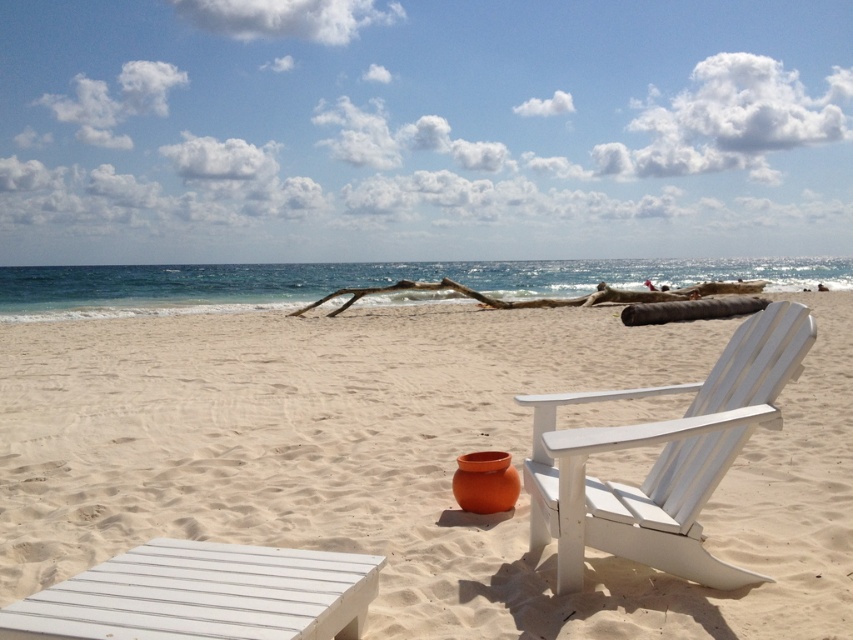
You are standing on the beach and want to place a 2.5 meter long surfboard between you and the white wood beach chair at center right. Is there enough space to place the surfboard without it overlapping the chair?

The distance between you and the white wood beach chair at center right is 2.43 meters. Since the surfboard is 2.5 meters long, it would require more space than available, so placing it without overlapping the chair is not possible.

You are planning to set up a small table between the white wood beach chair at center right and the brown wood at center. Based on their positions, which object should the table be placed closer to in order to be between them?

The table should be placed closer to the brown wood at center because the white wood beach chair at center right is located below it, meaning the brown wood at center is higher up, so placing the table closer to the higher object would position it between them.